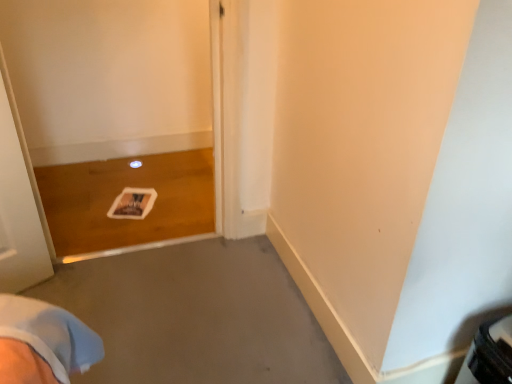
Image resolution: width=512 pixels, height=384 pixels. Describe the element at coordinates (195, 316) in the screenshot. I see `gray matte concrete at center` at that location.

What is the approximate width of gray matte concrete at center?

gray matte concrete at center is 39.08 inches in width.

Where is `gray matte concrete at center`? gray matte concrete at center is located at coordinates (195, 316).

Measure the distance between gray matte concrete at center and camera.

gray matte concrete at center is 1.29 meters from camera.

This screenshot has width=512, height=384. Describe the element at coordinates (115, 116) in the screenshot. I see `white glossy door at lower left` at that location.

Locate an element on the screen. The height and width of the screenshot is (384, 512). white glossy door at lower left is located at coordinates (115, 116).

The image size is (512, 384). What are the coordinates of `gray matte concrete at center` in the screenshot? It's located at (195, 316).

Considering the relative positions of gray matte concrete at center and white glossy door at lower left in the image provided, is gray matte concrete at center to the left of white glossy door at lower left from the viewer's perspective?

No, gray matte concrete at center is not to the left of white glossy door at lower left.

Is gray matte concrete at center behind white glossy door at lower left?

No, the depth of gray matte concrete at center is less than that of white glossy door at lower left.

Which point is more distant from viewer, [126,294] or [172,97]?

The point [172,97] is more distant.

From the image's perspective, which is above, gray matte concrete at center or white glossy door at lower left?

white glossy door at lower left, from the image's perspective.

Looking at this image, from a real-world perspective, is gray matte concrete at center physically below white glossy door at lower left?

Yes, from a real-world perspective, gray matte concrete at center is beneath white glossy door at lower left.

Is gray matte concrete at center wider than white glossy door at lower left?

Yes, gray matte concrete at center is wider than white glossy door at lower left.

From their relative heights in the image, would you say gray matte concrete at center is taller or shorter than white glossy door at lower left?

Clearly, gray matte concrete at center is shorter compared to white glossy door at lower left.

Who is bigger, gray matte concrete at center or white glossy door at lower left?

white glossy door at lower left is bigger.

Is gray matte concrete at center not within white glossy door at lower left?

Absolutely, gray matte concrete at center is external to white glossy door at lower left.

Is gray matte concrete at center far away from white glossy door at lower left?

No.

Consider the image. Is gray matte concrete at center facing towards white glossy door at lower left?

Yes, gray matte concrete at center is facing white glossy door at lower left.

How many degrees apart are the facing directions of gray matte concrete at center and white glossy door at lower left?

180 degrees.

How distant is gray matte concrete at center from white glossy door at lower left?

They are 27.99 inches apart.

You are a GUI agent. You are given a task and a screenshot of the screen. Output one action in this format:
    pyautogui.click(x=<x>, y=<y>)
    Task: Click on the screen door above the gray matte concrete at center (from the image's perspective)
    This screenshot has width=512, height=384.
    Given the screenshot: What is the action you would take?
    pyautogui.click(x=115, y=116)

Which object is positioned more to the left, white glossy door at lower left or gray matte concrete at center?

Positioned to the left is white glossy door at lower left.

Considering the relative positions of white glossy door at lower left and gray matte concrete at center in the image provided, is white glossy door at lower left in front of gray matte concrete at center?

That is False.

Is point (78, 107) positioned before point (249, 375)?

No, it is behind (249, 375).

From the image's perspective, which one is positioned higher, white glossy door at lower left or gray matte concrete at center?

white glossy door at lower left is shown above in the image.

From a real-world perspective, which is physically below, white glossy door at lower left or gray matte concrete at center?

From a 3D spatial view, gray matte concrete at center is below.

Is white glossy door at lower left wider or thinner than gray matte concrete at center?

Considering their sizes, white glossy door at lower left looks slimmer than gray matte concrete at center.

Can you confirm if white glossy door at lower left is shorter than gray matte concrete at center?

Incorrect, the height of white glossy door at lower left does not fall short of that of gray matte concrete at center.

From the picture: Considering the sizes of objects white glossy door at lower left and gray matte concrete at center in the image provided, who is bigger, white glossy door at lower left or gray matte concrete at center?

white glossy door at lower left is bigger.

Would you say white glossy door at lower left is outside gray matte concrete at center?

Indeed, white glossy door at lower left is completely outside gray matte concrete at center.

Are white glossy door at lower left and gray matte concrete at center located far from each other?

No.

Is white glossy door at lower left looking in the opposite direction of gray matte concrete at center?

white glossy door at lower left is not turned away from gray matte concrete at center.

Locate an element on the screen. The image size is (512, 384). screen door above the gray matte concrete at center (from the image's perspective) is located at coordinates coord(115,116).

The height and width of the screenshot is (384, 512). What are the coordinates of `concrete in front of the white glossy door at lower left` in the screenshot? It's located at (195, 316).

At what (x,y) coordinates should I click in order to perform the action: click on screen door above the gray matte concrete at center (from a real-world perspective). Please return your answer as a coordinate pair (x, y). Image resolution: width=512 pixels, height=384 pixels. Looking at the image, I should click on (115, 116).